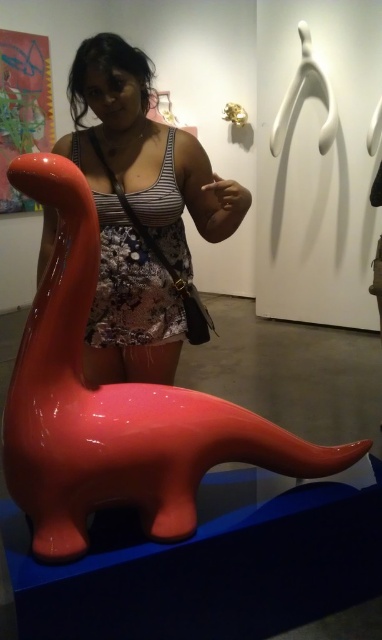
You are an art curator preparing to install a new exhibit. You have two items to place in the gallery space shown in the image. The first is the glossy plastic dinosaur at lower left, and the second is the matte black tank top at center. The gallery requires that the wider object must be placed on the east wall. Which object should be placed on the east wall?

The glossy plastic dinosaur at lower left should be placed on the east wall because its width surpasses that of the matte black tank top at center, making it the wider object.

You are an art curator examining the layout of this gallery space. You need to ensure that the glossy plastic dinosaur at lower left is visible to visitors without obstruction. Considering the position of the matte black tank top at center, is there any part of the dinosaur that might be blocked from view?

The glossy plastic dinosaur at lower left is positioned under the matte black tank top at center, so the lower part of the dinosaur might be blocked by the tank top, making it less visible to visitors.